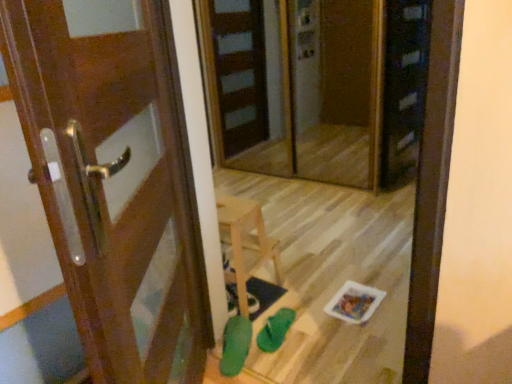
Question: Looking at the image, does transparent glass screen door at center seem bigger or smaller compared to green rubber shoe at lower center, which is the 1th shoe from right to left?

Choices:
 (A) small
 (B) big

Answer: (B)

Question: From a real-world perspective, is transparent glass screen door at center above or below green rubber shoe at lower center, the 2th shoe in the left-to-right sequence?

Choices:
 (A) above
 (B) below

Answer: (A)

Question: Estimate the real-world distances between objects in this image. Which object is farther from the transparent glass screen door at center?

Choices:
 (A) green rubber shoe at lower center, the 2th shoe in the left-to-right sequence
 (B) green rubber shoe at lower center, arranged as the first shoe when viewed from the left
 (C) wooden door at left

Answer: (B)

Question: Which of these objects is positioned closest to the green rubber shoe at lower center, which is the second shoe in right-to-left order?

Choices:
 (A) green rubber shoe at lower center, the 2th shoe in the left-to-right sequence
 (B) transparent glass screen door at center
 (C) wooden door at left

Answer: (A)